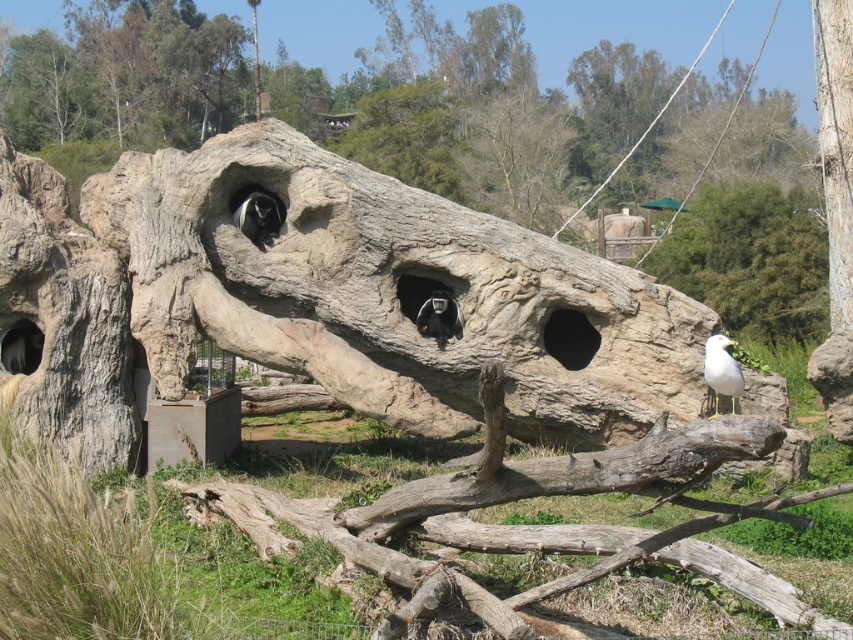
You are a zookeeper standing in the enclosure and want to feed the white feathered bird at lower right. If your longest reaching tool can extend 15 feet, will you be able to reach the bird?

The white feathered bird at lower right is 20.49 feet away from the viewer. Since the tool can only extend 15 feet, the zookeeper will not be able to reach the bird.

You are a zookeeper observing the zoo enclosure. You notice the white feathered bird at lower right and the black fur monkey at center. Which animal is bigger in size?

The white feathered bird at lower right is larger in size compared to the black fur monkey at center.

You are a zookeeper who needs to feed the black fur monkey at upper center. The feeding tool you have can reach up to 2 meters. The distance from your position to the black matte hole at center is 1.5 meters. Can you reach the monkey with your tool?

The black matte hole at center is closer to the viewer than the black fur monkey at upper center. Since the distance to the hole is 1.5 meters and the tool can reach 2 meters, the monkey is further away than the hole. Therefore, the tool may not reach the monkey if the monkey is beyond 2 meters from you.